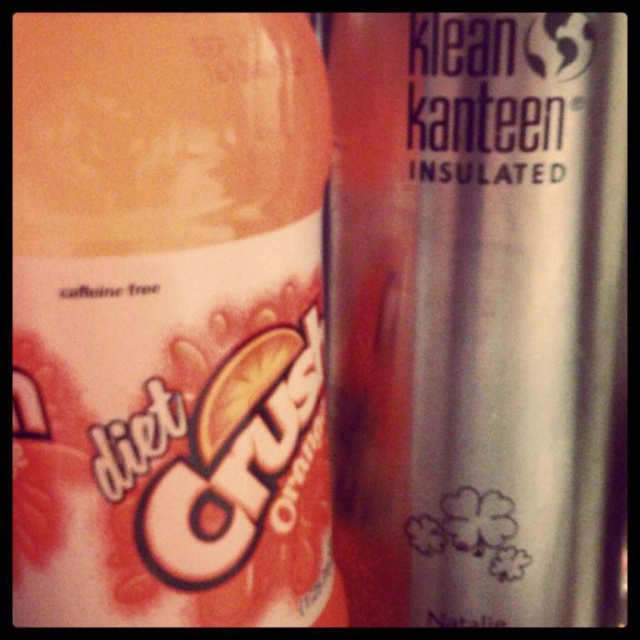
Question: Which point appears farthest from the camera in this image?

Choices:
 (A) (310, 284)
 (B) (376, 147)

Answer: (B)

Question: Can you confirm if matte plastic bottle at center is positioned to the right of silver metallic water bottle at right?

Choices:
 (A) yes
 (B) no

Answer: (B)

Question: Considering the relative positions of matte plastic bottle at center and silver metallic water bottle at right in the image provided, where is matte plastic bottle at center located with respect to silver metallic water bottle at right?

Choices:
 (A) below
 (B) above

Answer: (A)

Question: Is the position of matte plastic bottle at center more distant than that of silver metallic water bottle at right?

Choices:
 (A) no
 (B) yes

Answer: (A)

Question: Which point is closer to the camera?

Choices:
 (A) (340, 458)
 (B) (51, 611)

Answer: (B)